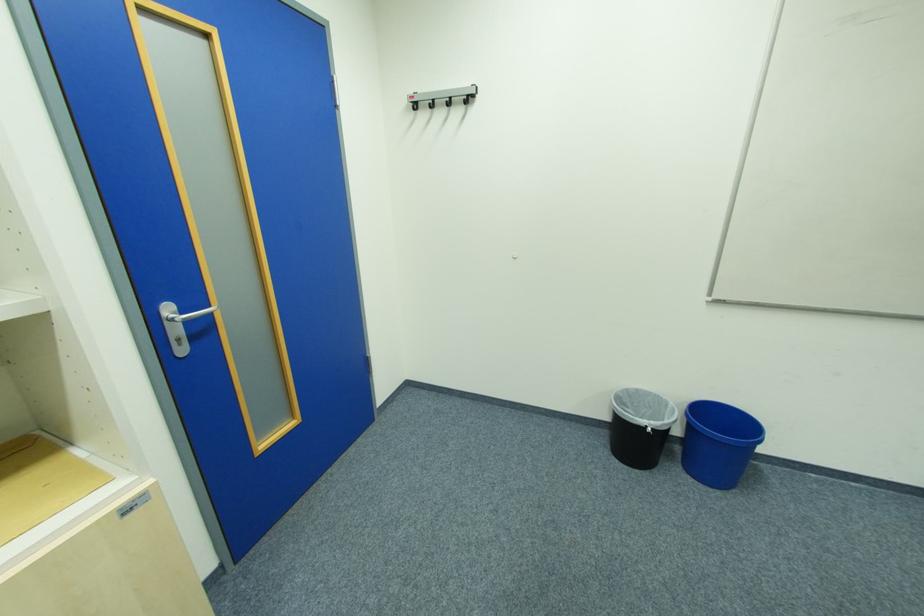
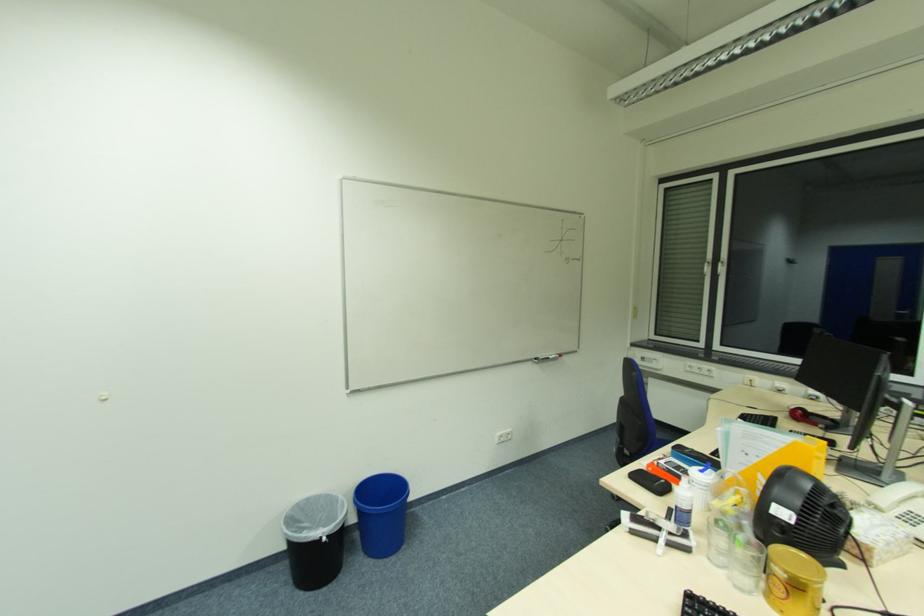
Question: The camera is either moving clockwise (left) or counter-clockwise (right) around the object. The first image is from the beginning of the video and the second image is from the end. Is the camera moving left or right when shooting the video?

Choices:
 (A) Left
 (B) Right

Answer: (A)